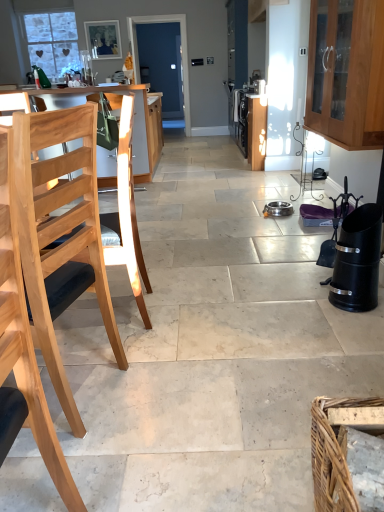
What do you see at coordinates (60, 215) in the screenshot?
I see `natural wood chair at left` at bounding box center [60, 215].

Describe the element at coordinates (146, 134) in the screenshot. The height and width of the screenshot is (512, 384). I see `wooden chair at left, marked as the second cabinetry in a front-to-back arrangement` at that location.

Image resolution: width=384 pixels, height=512 pixels. I want to click on light wood table at left, so click(134, 121).

Based on the photo, which object is positioned more to the right, blue glass door at center or natural wood chair at left?

From the viewer's perspective, natural wood chair at left appears more on the right side.

This screenshot has width=384, height=512. Find the location of `chair below the blue glass door at center (from a real-world perspective)`. chair below the blue glass door at center (from a real-world perspective) is located at coordinates point(60,215).

How different are the orientations of blue glass door at center and natural wood chair at left in degrees?

The facing directions of blue glass door at center and natural wood chair at left are 104 degrees apart.

From the picture: Is the depth of blue glass door at center greater than that of natural wood chair at left?

Yes.

Which object is positioned more to the left, light wood table at left or blue glass door at center?

From the viewer's perspective, light wood table at left appears more on the left side.

Is light wood table at left wider or thinner than blue glass door at center?

Clearly, light wood table at left has more width compared to blue glass door at center.

From the image's perspective, which one is positioned higher, light wood table at left or blue glass door at center?

blue glass door at center appears higher in the image.

Is light wood table at left oriented away from blue glass door at center?

light wood table at left does not have its back to blue glass door at center.

Would you say natural wood chair at left is a long distance from blue glass door at center?

natural wood chair at left is far away from blue glass door at center.

Does natural wood chair at left have a lesser height compared to blue glass door at center?

Yes, natural wood chair at left is shorter than blue glass door at center.

Where is `chair on the right of blue glass door at center`? chair on the right of blue glass door at center is located at coordinates (60, 215).

Between natural wood chair at left and blue glass door at center, which one has larger width?

With larger width is natural wood chair at left.

Where is `cabinetry located underneath the light wood table at left (from a real-world perspective)`? cabinetry located underneath the light wood table at left (from a real-world perspective) is located at coordinates (146, 134).

Which is less distant, (133, 152) or (101, 177)?

Positioned in front is point (101, 177).

Does light wood table at left touch wooden chair at left, marked as the second cabinetry in a front-to-back arrangement?

Indeed, light wood table at left and wooden chair at left, marked as the second cabinetry in a front-to-back arrangement, are beside each other and touching.

Is wooden cabinet at upper right, acting as the second cabinetry starting from the left, positioned in front of wooden chair at left, marked as the second cabinetry in a front-to-back arrangement?

Yes, it is in front of wooden chair at left, marked as the second cabinetry in a front-to-back arrangement.

In terms of width, does wooden cabinet at upper right, the 2th cabinetry when ordered from back to front, look wider or thinner when compared to wooden chair at left, marked as the second cabinetry in a front-to-back arrangement?

In the image, wooden cabinet at upper right, the 2th cabinetry when ordered from back to front, appears to be more narrow than wooden chair at left, marked as the second cabinetry in a front-to-back arrangement.

Who is taller, wooden cabinet at upper right, positioned as the 1th cabinetry in right-to-left order, or wooden chair at left, the second cabinetry when ordered from right to left?

wooden chair at left, the second cabinetry when ordered from right to left.

From the image's perspective, is wooden cabinet at upper right, positioned as the 1th cabinetry in right-to-left order, located beneath wooden chair at left, marked as the second cabinetry in a front-to-back arrangement?

Actually, wooden cabinet at upper right, positioned as the 1th cabinetry in right-to-left order, appears above wooden chair at left, marked as the second cabinetry in a front-to-back arrangement, in the image.

Considering the relative sizes of light wood table at left and wooden cabinet at upper right, positioned as the 1th cabinetry in right-to-left order, in the image provided, is light wood table at left smaller than wooden cabinet at upper right, positioned as the 1th cabinetry in right-to-left order,?

No, light wood table at left is not smaller than wooden cabinet at upper right, positioned as the 1th cabinetry in right-to-left order.

Where is `table below the wooden cabinet at upper right, acting as the second cabinetry starting from the left (from a real-world perspective)`? table below the wooden cabinet at upper right, acting as the second cabinetry starting from the left (from a real-world perspective) is located at coordinates (134, 121).

Is point (149, 114) less distant than point (364, 81)?

No, it is behind (364, 81).

From the image's perspective, is light wood table at left beneath wooden cabinet at upper right, the 2th cabinetry when ordered from back to front?

No, from the image's perspective, light wood table at left is not below wooden cabinet at upper right, the 2th cabinetry when ordered from back to front.

Is blue glass door at center smaller than wooden cabinet at upper right, which appears as the first cabinetry when viewed from the front?

Indeed, blue glass door at center has a smaller size compared to wooden cabinet at upper right, which appears as the first cabinetry when viewed from the front.

Is blue glass door at center oriented towards wooden cabinet at upper right, positioned as the 1th cabinetry in right-to-left order?

No.

Does point (152, 64) come closer to viewer compared to point (314, 80)?

No, it is not.

Which object is further away from the camera taking this photo, blue glass door at center or wooden cabinet at upper right, the 2th cabinetry when ordered from back to front?

Positioned behind is blue glass door at center.

Find the location of a particular element. glass door on the left of natural wood chair at left is located at coordinates (162, 64).

Where is `table that is below the blue glass door at center (from the image's perspective)`? table that is below the blue glass door at center (from the image's perspective) is located at coordinates (134, 121).

Based on their spatial positions, is wooden chair at left, marked as the second cabinetry in a front-to-back arrangement, or brown woven basket at lower right closer to natural wood chair at left?

Among the two, brown woven basket at lower right is located nearer to natural wood chair at left.

Looking at the image, which one is located closer to natural wood chair at left, brown woven basket at lower right or white frosted glass window at upper left?

brown woven basket at lower right.

Estimate the real-world distances between objects in this image. Which object is further from wooden cabinet at upper right, acting as the second cabinetry starting from the left, blue glass door at center or white frosted glass window at upper left?

The object further to wooden cabinet at upper right, acting as the second cabinetry starting from the left, is blue glass door at center.

When comparing their distances from white frosted glass window at upper left, does light wood table at left or wooden chair at left, positioned as the first cabinetry in back-to-front order, seem closer?

light wood table at left is closer to white frosted glass window at upper left.

Based on their spatial positions, is white frosted glass window at upper left or natural wood chair at left further from brown woven basket at lower right?

white frosted glass window at upper left lies further to brown woven basket at lower right than the other object.

Based on their spatial positions, is wooden chair at left, the second cabinetry when ordered from right to left, or blue glass door at center further from brown woven basket at lower right?

blue glass door at center is further to brown woven basket at lower right.

Which object lies nearer to the anchor point white frosted glass window at upper left, natural wood chair at left or light wood table at left?

Among the two, light wood table at left is located nearer to white frosted glass window at upper left.

Looking at the image, which one is located further to wooden cabinet at upper right, which appears as the first cabinetry when viewed from the front, white frosted glass window at upper left or blue glass door at center?

Based on the image, blue glass door at center appears to be further to wooden cabinet at upper right, which appears as the first cabinetry when viewed from the front.

I want to click on cabinetry located between wooden cabinet at upper right, positioned as the 1th cabinetry in right-to-left order, and blue glass door at center in the depth direction, so click(x=146, y=134).

Locate an element on the screen. Image resolution: width=384 pixels, height=512 pixels. cabinetry between brown woven basket at lower right and wooden chair at left, positioned as the first cabinetry in back-to-front order, along the z-axis is located at coordinates (350, 76).

You are a GUI agent. You are given a task and a screenshot of the screen. Output one action in this format:
    pyautogui.click(x=<x>, y=<y>)
    Task: Click on the chair between wooden cabinet at upper right, the 2th cabinetry when ordered from back to front, and brown woven basket at lower right vertically
    This screenshot has height=512, width=384.
    Given the screenshot: What is the action you would take?
    click(60, 215)

Locate an element on the screen. The height and width of the screenshot is (512, 384). cabinetry between wooden cabinet at upper right, positioned as the 1th cabinetry in right-to-left order, and white frosted glass window at upper left in the front-back direction is located at coordinates (146, 134).